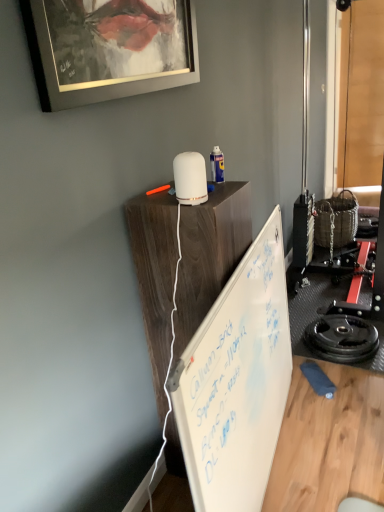
Question: Should I look upward or downward to see black rubber weight plate at lower right?

Choices:
 (A) down
 (B) up

Answer: (A)

Question: Does white matte wood table at upper center come in front of white matte diffuser at upper center?

Choices:
 (A) yes
 (B) no

Answer: (B)

Question: Does white matte wood table at upper center touch white matte diffuser at upper center?

Choices:
 (A) no
 (B) yes

Answer: (A)

Question: Is white matte wood table at upper center to the right of white matte diffuser at upper center from the viewer's perspective?

Choices:
 (A) yes
 (B) no

Answer: (A)

Question: Is white matte wood table at upper center bigger than white matte diffuser at upper center?

Choices:
 (A) no
 (B) yes

Answer: (B)

Question: From the image's perspective, is white matte wood table at upper center on white matte diffuser at upper center?

Choices:
 (A) no
 (B) yes

Answer: (A)

Question: From a real-world perspective, is white matte wood table at upper center below white matte diffuser at upper center?

Choices:
 (A) no
 (B) yes

Answer: (B)

Question: From a real-world perspective, is white matte diffuser at upper center physically below metallic silver picture frame at upper left?

Choices:
 (A) yes
 (B) no

Answer: (A)

Question: Is metallic silver picture frame at upper left located within white matte diffuser at upper center?

Choices:
 (A) yes
 (B) no

Answer: (B)

Question: From the image's perspective, is white matte diffuser at upper center located beneath metallic silver picture frame at upper left?

Choices:
 (A) no
 (B) yes

Answer: (B)

Question: Is white matte diffuser at upper center looking in the opposite direction of metallic silver picture frame at upper left?

Choices:
 (A) no
 (B) yes

Answer: (A)

Question: From a real-world perspective, does white matte diffuser at upper center stand above metallic silver picture frame at upper left?

Choices:
 (A) yes
 (B) no

Answer: (B)

Question: Is the surface of white matte diffuser at upper center in direct contact with metallic silver picture frame at upper left?

Choices:
 (A) no
 (B) yes

Answer: (A)

Question: Is whiteboard at center thinner than black rubber weight plate at lower right?

Choices:
 (A) yes
 (B) no

Answer: (B)